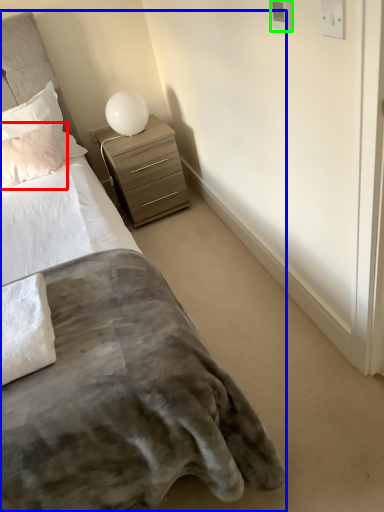
Question: Which object is positioned farthest from pillow (highlighted by a red box)? Select from bed (highlighted by a blue box) and electric outlet (highlighted by a green box).

Choices:
 (A) bed
 (B) electric outlet

Answer: (B)